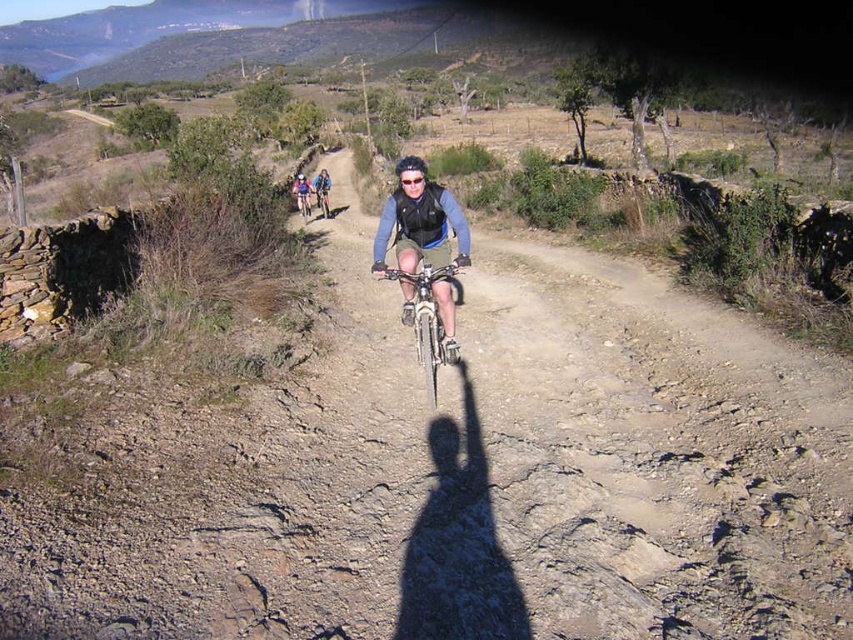
Is point (415, 332) less distant than point (410, 170)?

No, it is behind (410, 170).

The width and height of the screenshot is (853, 640). Find the location of `silver metallic bicycle at center`. silver metallic bicycle at center is located at coordinates (426, 321).